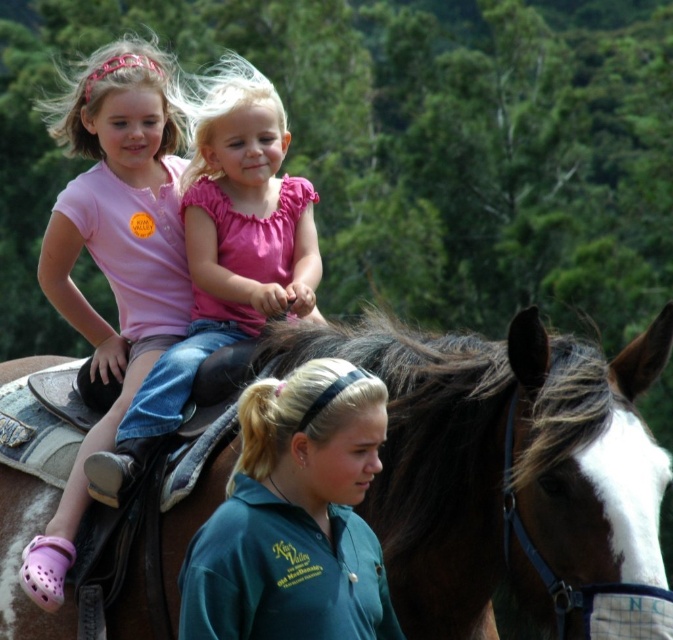
You are a photographer standing in the middle of the forest. You want to take a photo of the two girls wearing the pink matte shirt at upper left and the pink cotton shirt at upper center. If you need them to be at least 6 feet apart for the perfect shot, will their current distance work?

The pink matte shirt at upper left and pink cotton shirt at upper center are currently 5.87 feet apart, which is less than the required 6 feet. Therefore, they need to move slightly farther apart to achieve the desired distance for the perfect shot.

You are a photographer trying to capture a photo of the two girls on the horse. You notice their shirts are both pink but have different textures. Which girl is wearing the pink matte shirt at upper left and positioned to the left of the other pink cotton shirt at upper center?

The girl wearing the pink matte shirt at upper left is positioned to the left of the pink cotton shirt at upper center, so she is the one on the left side.